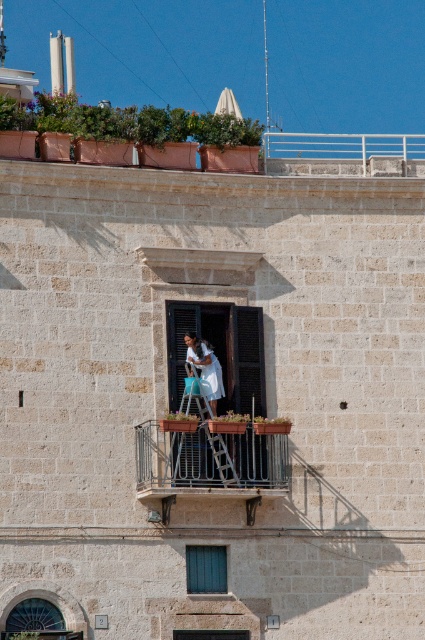
Does white cotton dress at center have a greater width compared to matte stone window at center?

Yes.

The image size is (425, 640). I want to click on white cotton dress at center, so click(x=206, y=368).

Does point (218, 392) lie behind point (183, 632)?

Yes, it is behind point (183, 632).

You are a GUI agent. You are given a task and a screenshot of the screen. Output one action in this format:
    pyautogui.click(x=<x>, y=<y>)
    Task: Click on the white cotton dress at center
    This screenshot has width=425, height=640.
    Given the screenshot: What is the action you would take?
    pyautogui.click(x=206, y=368)

Can you confirm if rustic wood balcony at center is positioned below matte stone window at center?

Actually, rustic wood balcony at center is above matte stone window at center.

Is rustic wood balcony at center wider than matte stone window at center?

Yes.

I want to click on rustic wood balcony at center, so click(x=209, y=465).

Between point (206, 561) and point (212, 388), which one is positioned behind?

The point (212, 388) is behind.

Between green matte window at center and white cotton dress at center, which one has more height?

white cotton dress at center

Is point (207, 592) positioned behind point (215, 401)?

No, (207, 592) is in front of (215, 401).

You are a GUI agent. You are given a task and a screenshot of the screen. Output one action in this format:
    pyautogui.click(x=<x>, y=<y>)
    Task: Click on the green matte window at center
    This screenshot has width=425, height=640.
    Given the screenshot: What is the action you would take?
    pyautogui.click(x=206, y=568)